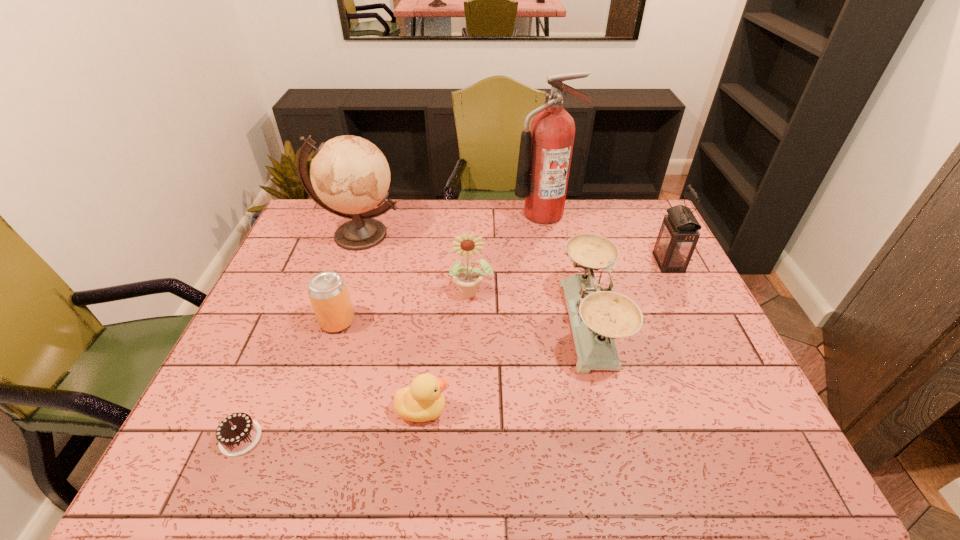
Find the location of a particular element. vacant space that is in between the duck and the sunflower is located at coordinates (446, 351).

Identify the location of object that ranks as the seventh closest to the tallest object. The height and width of the screenshot is (540, 960). (x=237, y=434).

Where is `object that is the second closest one to the sunflower`? This screenshot has height=540, width=960. object that is the second closest one to the sunflower is located at coordinates (350, 175).

I want to click on free space that satisfies the following two spatial constraints: 1. on the front-facing side of the rightmost object; 2. on the front-facing side of the sunflower, so click(x=683, y=292).

Identify the location of free space in the image that satisfies the following two spatial constraints: 1. on the back side of the shortest object; 2. on the left side of the sixth tallest object. This screenshot has width=960, height=540. (290, 321).

Identify the location of vacant space that satisfies the following two spatial constraints: 1. on the front-facing side of the sunflower; 2. at the beak of the second shortest object. This screenshot has height=540, width=960. (468, 409).